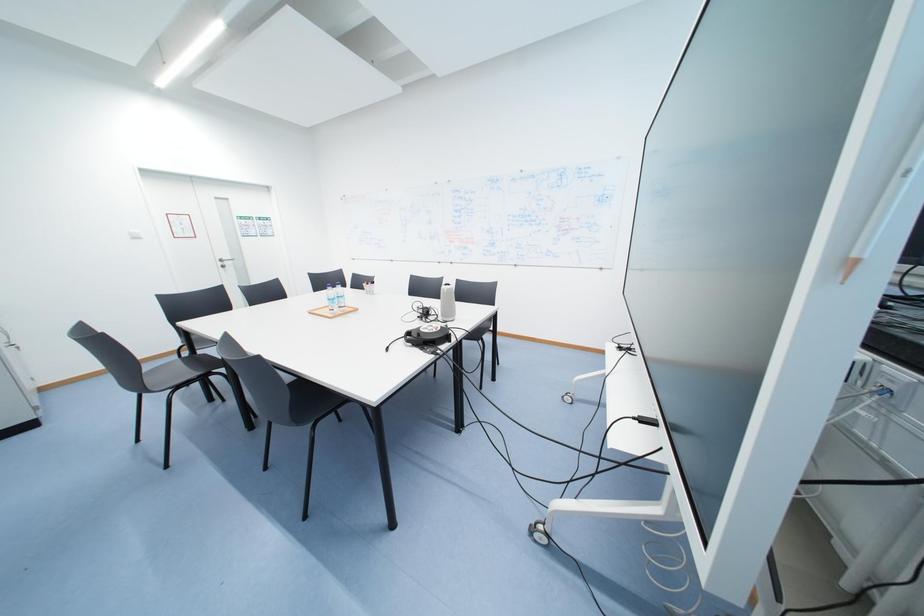
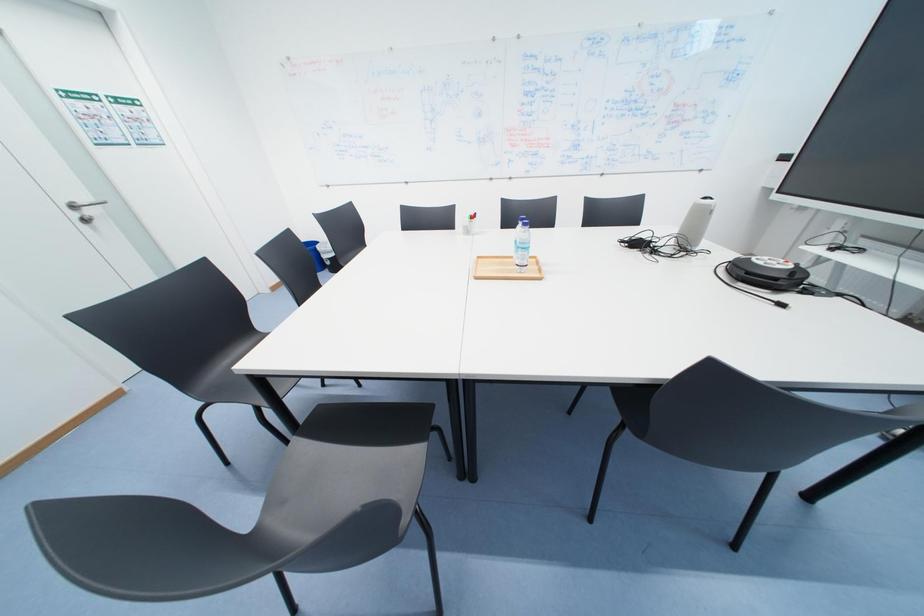
Which direction would the cameraman need to move to produce the second image?

The movement direction of the cameraman is left, forward.